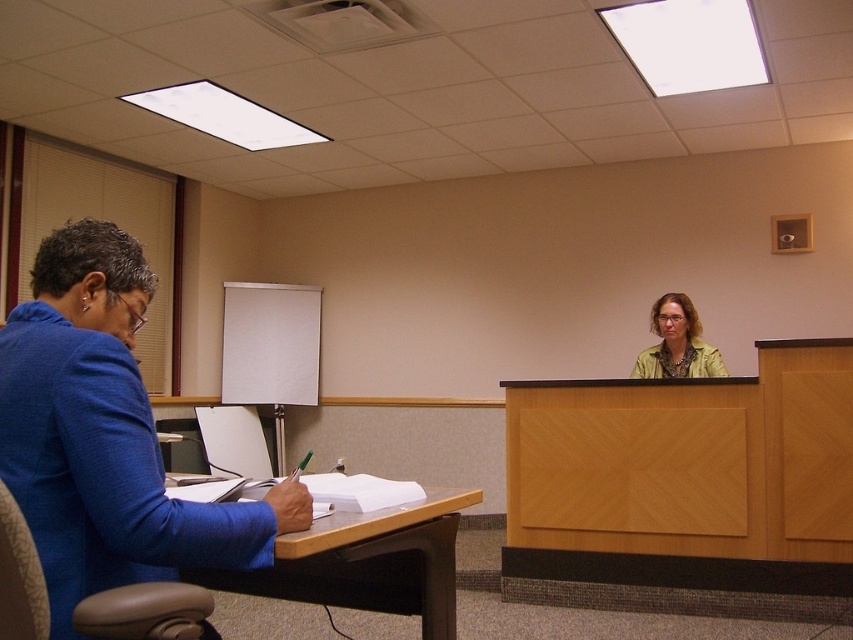
You are organizing a classroom and need to arrange items on a shelf. You have the blue fabric jacket at left and the wooden at left. Which item should you place first if you want to maximize shelf space utilization?

The blue fabric jacket at left occupies less space than the wooden at left, so you should place the wooden at left first to utilize the shelf space more efficiently.

You are a robot with a 1.2 meter arm reach. You need to pick up the blue fabric jacket at left from the desk. Can your arm reach it?

The blue fabric jacket at left is 1.12 meters away from the camera, so yes, the robot can reach it with its 1.2 meter arm.